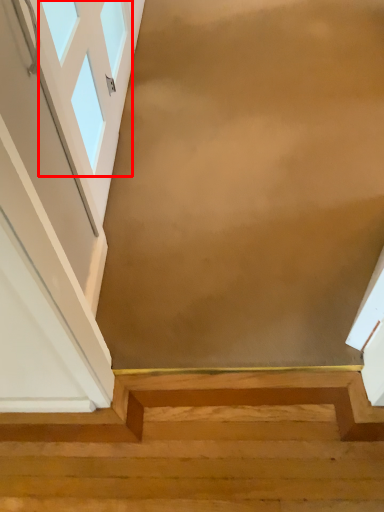
Question: From the image's perspective, where is window (annotated by the red box) located relative to stairs?

Choices:
 (A) above
 (B) below

Answer: (A)